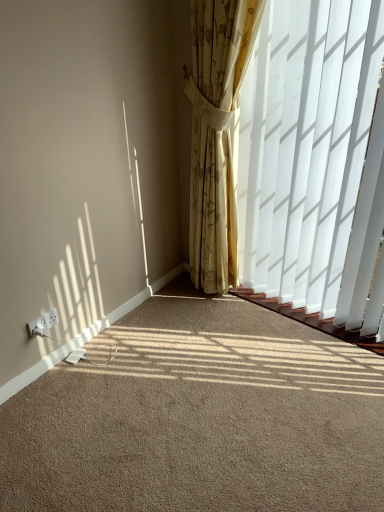
Question: Is yellow floral fabric curtain at center to the left of white plastic electric outlet at lower left from the viewer's perspective?

Choices:
 (A) yes
 (B) no

Answer: (B)

Question: Does yellow floral fabric curtain at center turn towards white plastic electric outlet at lower left?

Choices:
 (A) no
 (B) yes

Answer: (B)

Question: From the image's perspective, is yellow floral fabric curtain at center above white plastic electric outlet at lower left?

Choices:
 (A) no
 (B) yes

Answer: (B)

Question: From a real-world perspective, is yellow floral fabric curtain at center over white plastic electric outlet at lower left?

Choices:
 (A) no
 (B) yes

Answer: (B)

Question: Would you consider yellow floral fabric curtain at center to be distant from white plastic electric outlet at lower left?

Choices:
 (A) yes
 (B) no

Answer: (A)

Question: Is yellow floral fabric curtain at center outside of white plastic electric outlet at lower left?

Choices:
 (A) no
 (B) yes

Answer: (B)

Question: Is yellow floral fabric curtain at center a part of beige carpet at lower left?

Choices:
 (A) no
 (B) yes

Answer: (A)

Question: From a real-world perspective, is beige carpet at lower left beneath yellow floral fabric curtain at center?

Choices:
 (A) no
 (B) yes

Answer: (B)

Question: From a real-world perspective, is beige carpet at lower left on top of yellow floral fabric curtain at center?

Choices:
 (A) no
 (B) yes

Answer: (A)

Question: Does beige carpet at lower left have a greater height compared to yellow floral fabric curtain at center?

Choices:
 (A) no
 (B) yes

Answer: (A)

Question: Considering the relative sizes of beige carpet at lower left and yellow floral fabric curtain at center in the image provided, is beige carpet at lower left wider than yellow floral fabric curtain at center?

Choices:
 (A) no
 (B) yes

Answer: (B)

Question: Is beige carpet at lower left beside yellow floral fabric curtain at center?

Choices:
 (A) no
 (B) yes

Answer: (A)

Question: Considering the relative sizes of beige carpet at lower left and white plastic electric outlet at lower left in the image provided, is beige carpet at lower left shorter than white plastic electric outlet at lower left?

Choices:
 (A) yes
 (B) no

Answer: (A)